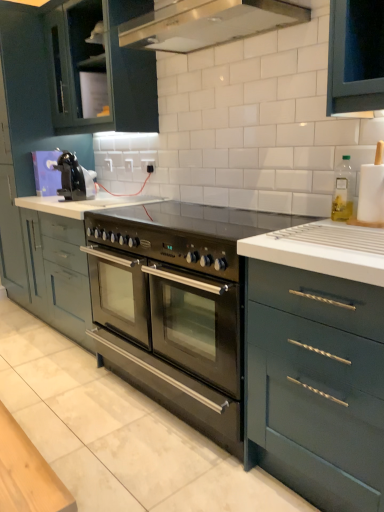
Question: Can you confirm if stainless steel gas stove at center is bigger than white matte paper towel holder at right, which is the 1th appliance in front-to-back order?

Choices:
 (A) yes
 (B) no

Answer: (A)

Question: Does stainless steel gas stove at center contain white matte paper towel holder at right, which is the 1th appliance in front-to-back order?

Choices:
 (A) yes
 (B) no

Answer: (B)

Question: Can you confirm if stainless steel gas stove at center is shorter than white matte paper towel holder at right, which is the 1th appliance in front-to-back order?

Choices:
 (A) yes
 (B) no

Answer: (A)

Question: Is stainless steel gas stove at center facing towards white matte paper towel holder at right, which is the 1th appliance in front-to-back order?

Choices:
 (A) no
 (B) yes

Answer: (A)

Question: Considering the relative sizes of stainless steel gas stove at center and white matte paper towel holder at right, which is the 1th appliance in front-to-back order, in the image provided, is stainless steel gas stove at center wider than white matte paper towel holder at right, which is the 1th appliance in front-to-back order,?

Choices:
 (A) yes
 (B) no

Answer: (A)

Question: From the image's perspective, is stainless steel gas stove at center below white matte paper towel holder at right, which is the 2th appliance from back to front?

Choices:
 (A) no
 (B) yes

Answer: (B)

Question: Is stainless steel oven at center, arranged as the 1th cabinetry when ordered from the bottom, in front of matte dark green cabinet at upper left, the 1th cabinetry viewed from the top?

Choices:
 (A) no
 (B) yes

Answer: (A)

Question: Could matte dark green cabinet at upper left, which is the 3th cabinetry from bottom to top, be considered to be inside stainless steel oven at center, the 3th cabinetry when ordered from top to bottom?

Choices:
 (A) yes
 (B) no

Answer: (B)

Question: Considering the relative sizes of stainless steel oven at center, the 3th cabinetry when ordered from top to bottom, and matte dark green cabinet at upper left, the 1th cabinetry viewed from the top, in the image provided, is stainless steel oven at center, the 3th cabinetry when ordered from top to bottom, wider than matte dark green cabinet at upper left, the 1th cabinetry viewed from the top,?

Choices:
 (A) yes
 (B) no

Answer: (A)

Question: From a real-world perspective, is stainless steel oven at center, the 3th cabinetry when ordered from top to bottom, below matte dark green cabinet at upper left, which is the 3th cabinetry from bottom to top?

Choices:
 (A) no
 (B) yes

Answer: (B)

Question: Is stainless steel oven at center, arranged as the 1th cabinetry when ordered from the bottom, looking in the opposite direction of matte dark green cabinet at upper left, the 1th cabinetry viewed from the top?

Choices:
 (A) no
 (B) yes

Answer: (A)

Question: Is stainless steel oven at center, the 3th cabinetry when ordered from top to bottom, smaller than matte dark green cabinet at upper left, which is the 3th cabinetry from bottom to top?

Choices:
 (A) no
 (B) yes

Answer: (A)

Question: From a real-world perspective, is stainless steel gas stove at center beneath black plastic outlet at center?

Choices:
 (A) no
 (B) yes

Answer: (B)